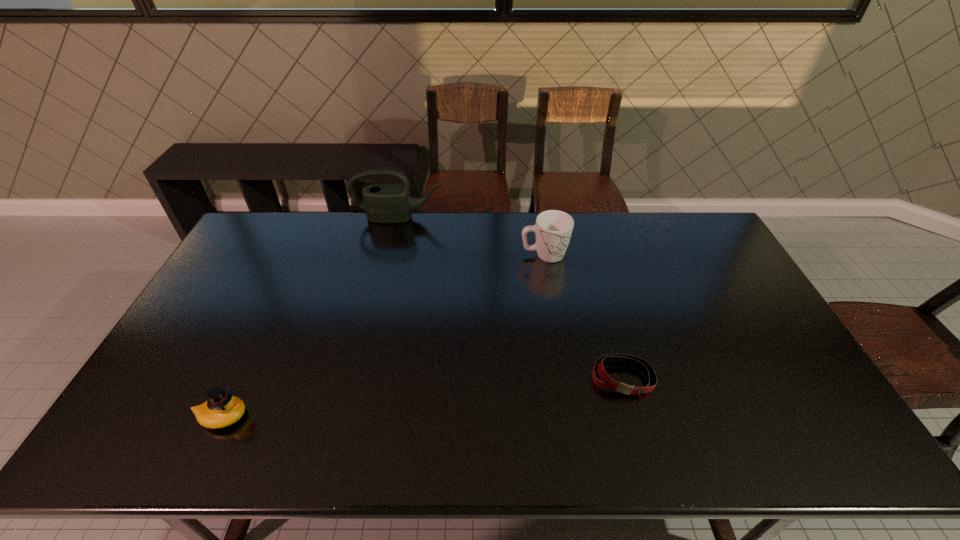
In order to click on the third object from right to left in this screenshot , I will do click(384, 203).

Locate an element on the screen. watering can is located at coordinates (384, 203).

The image size is (960, 540). What are the coordinates of `the third shortest object` in the screenshot? It's located at (553, 228).

In order to click on the second farthest object in this screenshot , I will do (553, 228).

Image resolution: width=960 pixels, height=540 pixels. Identify the location of duck. (222, 409).

Locate an element on the screen. The image size is (960, 540). the leftmost object is located at coordinates (222, 409).

At what (x,y) coordinates should I click in order to perform the action: click on the shortest object. Please return your answer as a coordinate pair (x, y). The width and height of the screenshot is (960, 540). Looking at the image, I should click on (608, 383).

Image resolution: width=960 pixels, height=540 pixels. What are the coordinates of `dog collar` in the screenshot? It's located at (608, 383).

Identify the location of free location located on the spout of the second object from left to right. (385, 280).

Where is `vacant space positioned on the side of the mug with the handle`? vacant space positioned on the side of the mug with the handle is located at coordinates (619, 255).